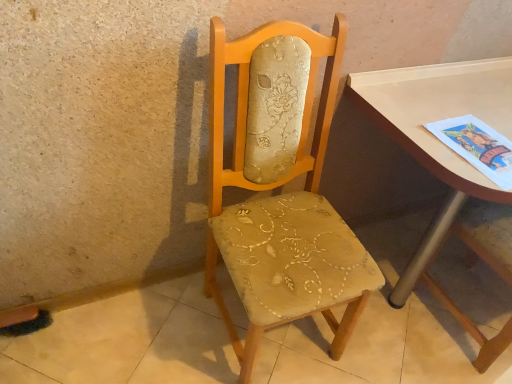
Question: Is point (504, 102) positioned closer to the camera than point (57, 337)?

Choices:
 (A) farther
 (B) closer

Answer: (B)

Question: Based on their sizes in the image, would you say matte white table at right is bigger or smaller than beige fabric chair at center?

Choices:
 (A) big
 (B) small

Answer: (A)

Question: Based on their relative distances, which object is nearer to the matte white table at right?

Choices:
 (A) beige fabric chair at center
 (B) matte beige fabric chair at center

Answer: (B)

Question: Estimate the real-world distances between objects in this image. Which object is closer to the matte beige fabric chair at center?

Choices:
 (A) matte white table at right
 (B) beige fabric chair at center

Answer: (A)